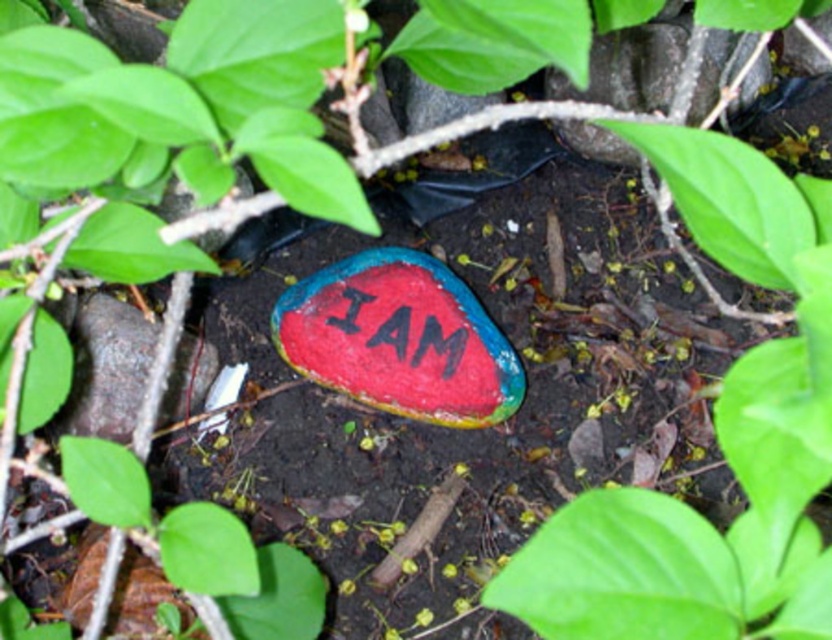
You are an artist who wants to paint a rock in the forest. You see the point at coordinates (717, 440). What object is located at that point?

The point at coordinates (717, 440) corresponds to the green matte rock at center.

You are an artist who wants to place a new sculpture in the scene. The green matte rock at center and the painted rock at center are already there. Which of these two rocks can you place a smaller sculpture next to without it being overshadowed?

The green matte rock at center occupies less space than the painted rock at center, so placing a smaller sculpture next to the green matte rock at center would prevent it from being overshadowed.